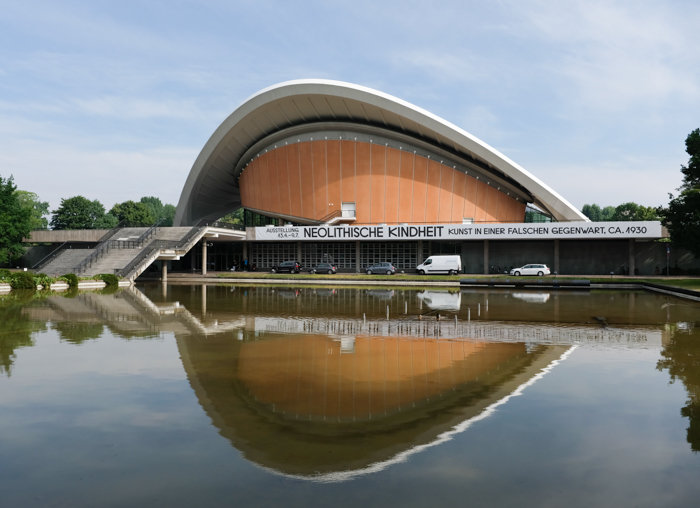
Where is `stairs`? stairs is located at coordinates (150, 252).